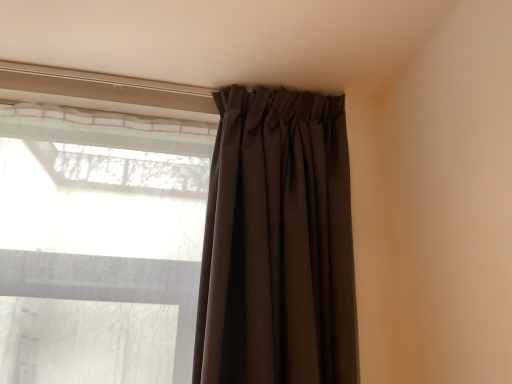
What are the coordinates of `dark brown textured curtain at upper center` in the screenshot? It's located at (278, 243).

Describe the element at coordinates (278, 243) in the screenshot. I see `dark brown textured curtain at upper center` at that location.

Measure the distance between dark brown textured curtain at upper center and camera.

dark brown textured curtain at upper center is 95.40 centimeters from camera.

I want to click on dark brown textured curtain at upper center, so click(278, 243).